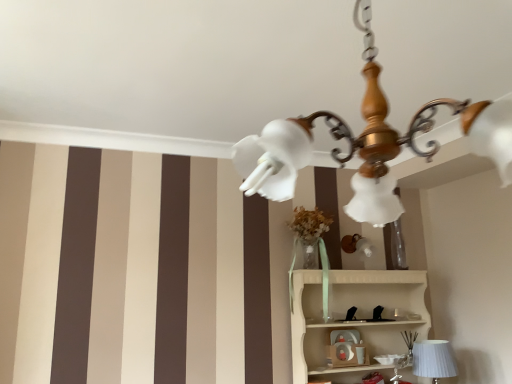
Question: Is white ribbed fabric at lower right surrounded by matte plastic toy at center?

Choices:
 (A) no
 (B) yes

Answer: (A)

Question: From a real-world perspective, is matte plastic toy at center located higher than white ribbed fabric at lower right?

Choices:
 (A) yes
 (B) no

Answer: (A)

Question: Is the depth of matte plastic toy at center less than that of white ribbed fabric at lower right?

Choices:
 (A) no
 (B) yes

Answer: (A)

Question: Is matte plastic toy at center oriented away from white ribbed fabric at lower right?

Choices:
 (A) yes
 (B) no

Answer: (B)

Question: Can you confirm if matte plastic toy at center is smaller than white ribbed fabric at lower right?

Choices:
 (A) no
 (B) yes

Answer: (B)

Question: Is matte plastic toy at center positioned far away from white ribbed fabric at lower right?

Choices:
 (A) yes
 (B) no

Answer: (B)

Question: Is the depth of white ribbed fabric at lower right less than that of white wood shelf at lower right?

Choices:
 (A) yes
 (B) no

Answer: (B)

Question: Is white ribbed fabric at lower right to the left of white wood shelf at lower right from the viewer's perspective?

Choices:
 (A) no
 (B) yes

Answer: (A)

Question: Would you say white ribbed fabric at lower right is a long distance from white wood shelf at lower right?

Choices:
 (A) yes
 (B) no

Answer: (B)

Question: Considering the relative sizes of white ribbed fabric at lower right and white wood shelf at lower right in the image provided, is white ribbed fabric at lower right taller than white wood shelf at lower right?

Choices:
 (A) yes
 (B) no

Answer: (B)

Question: Considering the relative sizes of white ribbed fabric at lower right and white wood shelf at lower right in the image provided, is white ribbed fabric at lower right wider than white wood shelf at lower right?

Choices:
 (A) no
 (B) yes

Answer: (A)

Question: Is white ribbed fabric at lower right oriented towards white wood shelf at lower right?

Choices:
 (A) yes
 (B) no

Answer: (A)

Question: From the image's perspective, is matte plastic toy at center located beneath wooden chandelier at upper center?

Choices:
 (A) no
 (B) yes

Answer: (B)